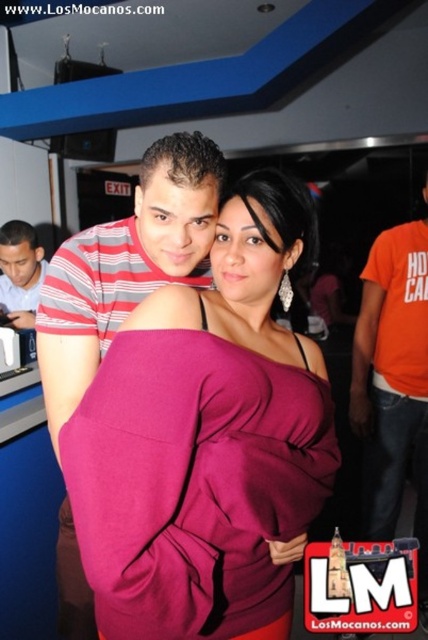
Question: Which of the following is the closest to the observer?

Choices:
 (A) orange cotton t-shirt at right
 (B) striped cotton shirt at left

Answer: (A)

Question: Which point appears farthest from the camera in this image?

Choices:
 (A) (15, 321)
 (B) (412, 284)

Answer: (A)

Question: Does burgundy satin dress at center lie in front of orange cotton t-shirt at right?

Choices:
 (A) yes
 (B) no

Answer: (A)

Question: Is burgundy satin dress at center to the left of orange cotton t-shirt at right from the viewer's perspective?

Choices:
 (A) yes
 (B) no

Answer: (A)

Question: Based on their relative distances, which object is farther from the striped cotton shirt at left?

Choices:
 (A) burgundy satin dress at center
 (B) orange cotton t-shirt at right

Answer: (B)

Question: Is burgundy satin dress at center thinner than striped cotton shirt at left?

Choices:
 (A) no
 (B) yes

Answer: (A)